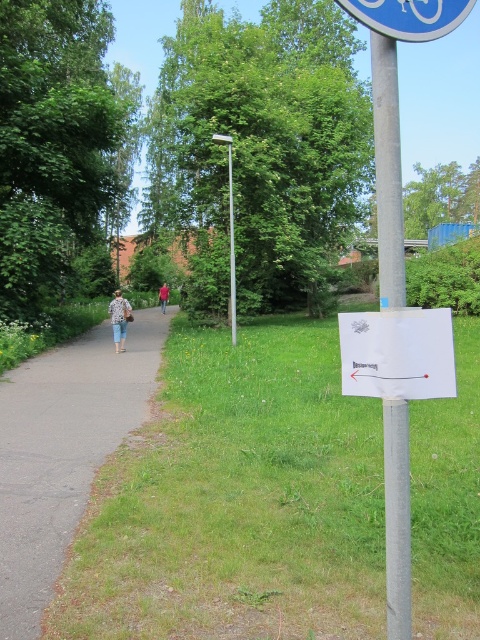
Is silver metallic pole at upper center further to camera compared to light brown leather jacket at center?

No, silver metallic pole at upper center is in front of light brown leather jacket at center.

Between silver metallic pole at upper center and light brown leather jacket at center, which one is positioned higher?

Positioned higher is light brown leather jacket at center.

Find the location of `silver metallic pole at upper center`. silver metallic pole at upper center is located at coordinates (387, 172).

Between dark gray asphalt at left and blue plastic sign at upper center, which one has more height?

dark gray asphalt at left is taller.

Find the location of `dark gray asphalt at left`. dark gray asphalt at left is located at coordinates (62, 451).

Does dark gray asphalt at left have a smaller size compared to silver metallic pole at upper center?

Yes.

Is dark gray asphalt at left further to the viewer compared to silver metallic pole at upper center?

Yes.

This screenshot has width=480, height=640. What are the coordinates of `dark gray asphalt at left` in the screenshot? It's located at (62, 451).